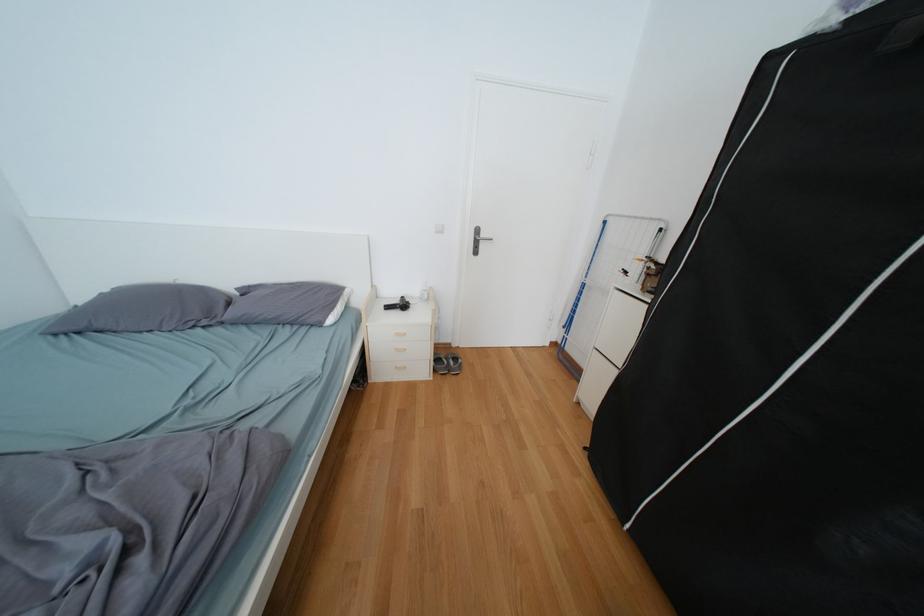
In order to click on white pump bottle in this screenshot , I will do 424,291.